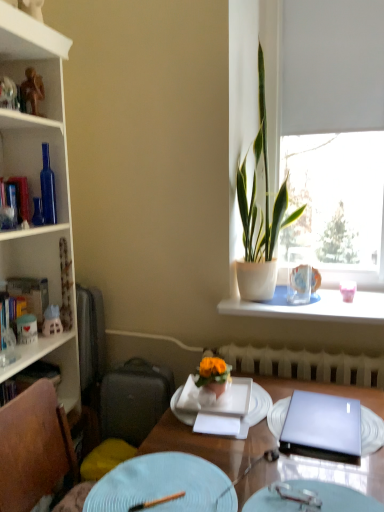
I want to click on free space behind light blue textured plate at lower center, the 3th plate from the back, so click(287, 465).